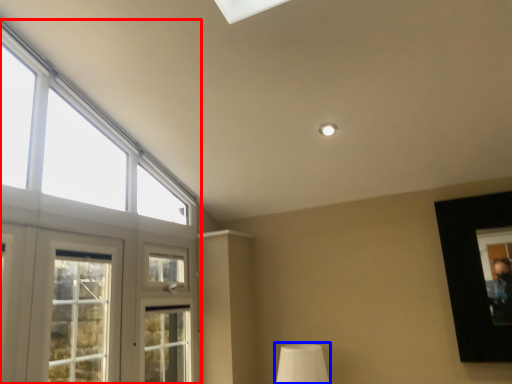
Question: Which point is further to the camera, window (highlighted by a red box) or table lamp (highlighted by a blue box)?

Choices:
 (A) window
 (B) table lamp

Answer: (B)